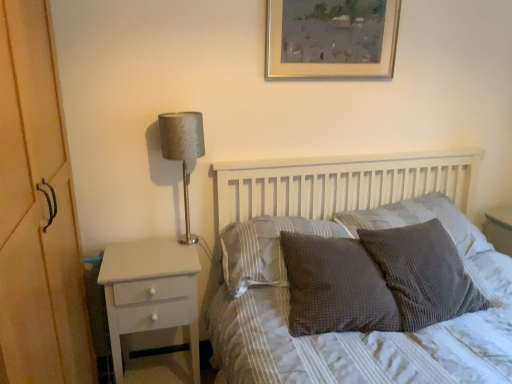
In order to click on blank space situated above satin silver lamp at left (from a real-world perspective) in this screenshot , I will do `click(177, 116)`.